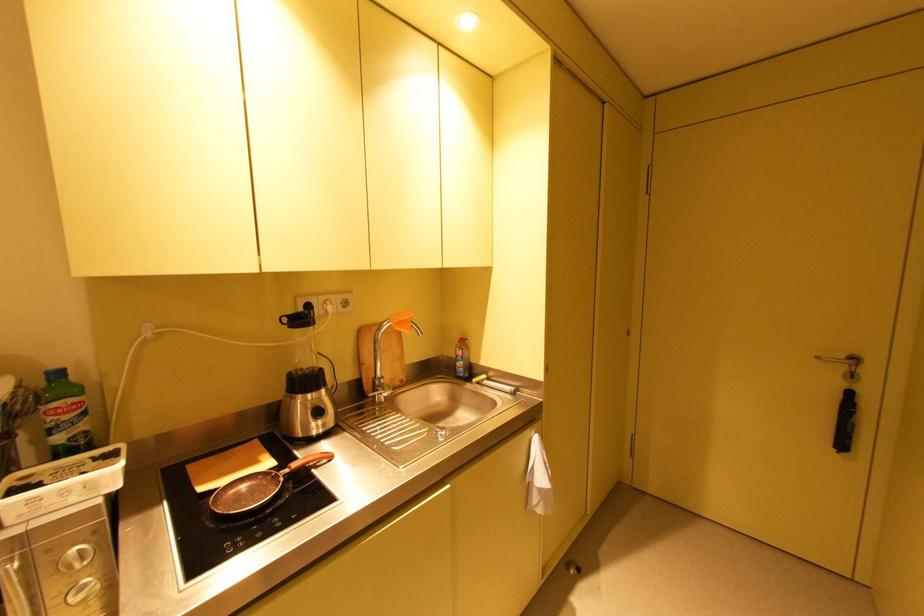
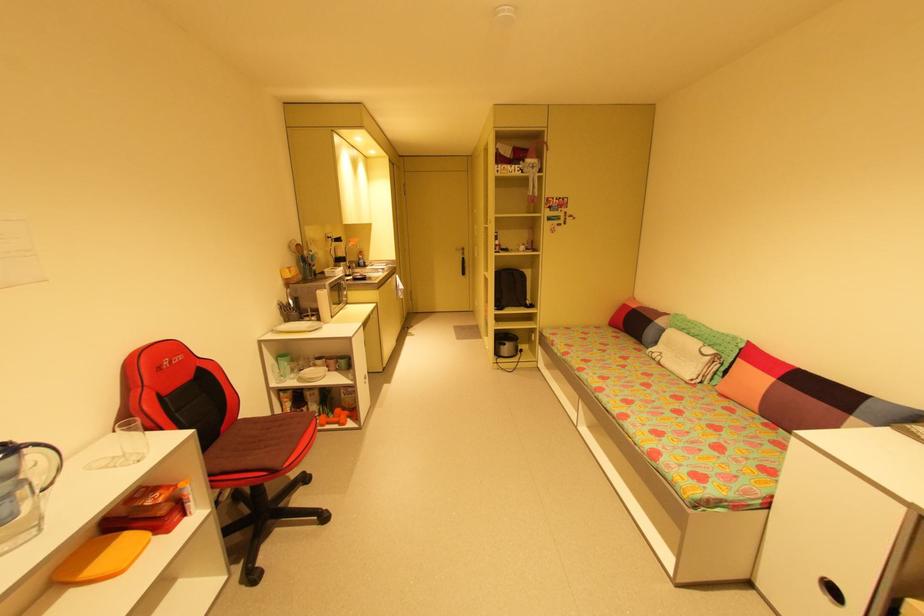
Find the pixel in the second image that matches (x=822, y=358) in the first image.

(460, 249)